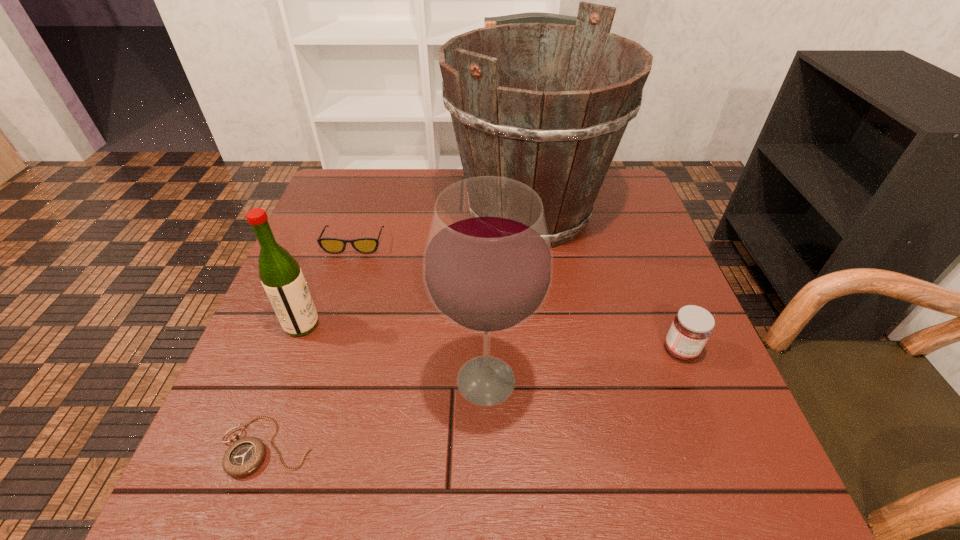
This screenshot has height=540, width=960. What are the coordinates of `free space between the bucket and the third shortest object` in the screenshot? It's located at (605, 281).

Locate an element on the screen. This screenshot has height=540, width=960. blank region between the shortest object and the fourth shortest object is located at coordinates (284, 385).

This screenshot has width=960, height=540. In order to click on free space between the pocket watch and the liquor in this screenshot , I will do `click(284, 385)`.

The width and height of the screenshot is (960, 540). I want to click on vacant space in between the alcohol and the jam, so click(x=584, y=365).

In order to click on vacant area that lies between the second tallest object and the fourth shortest object in this screenshot , I will do `click(394, 353)`.

You are a GUI agent. You are given a task and a screenshot of the screen. Output one action in this format:
    pyautogui.click(x=<x>, y=<y>)
    Task: Click on the unoccupied area between the alcohol and the third tallest object
    This screenshot has height=540, width=960.
    Given the screenshot: What is the action you would take?
    pyautogui.click(x=394, y=353)

The height and width of the screenshot is (540, 960). I want to click on free space between the sunglasses and the shortest object, so click(311, 345).

At what (x,y) coordinates should I click in order to perform the action: click on vacant area between the liquor and the fifth tallest object. Please return your answer as a coordinate pair (x, y). The image size is (960, 540). Looking at the image, I should click on (328, 284).

The height and width of the screenshot is (540, 960). Identify the location of vacant area that lies between the second tallest object and the second shortest object. tap(420, 312).

Find the location of `object that is the closest to the jam`. object that is the closest to the jam is located at coordinates (560, 138).